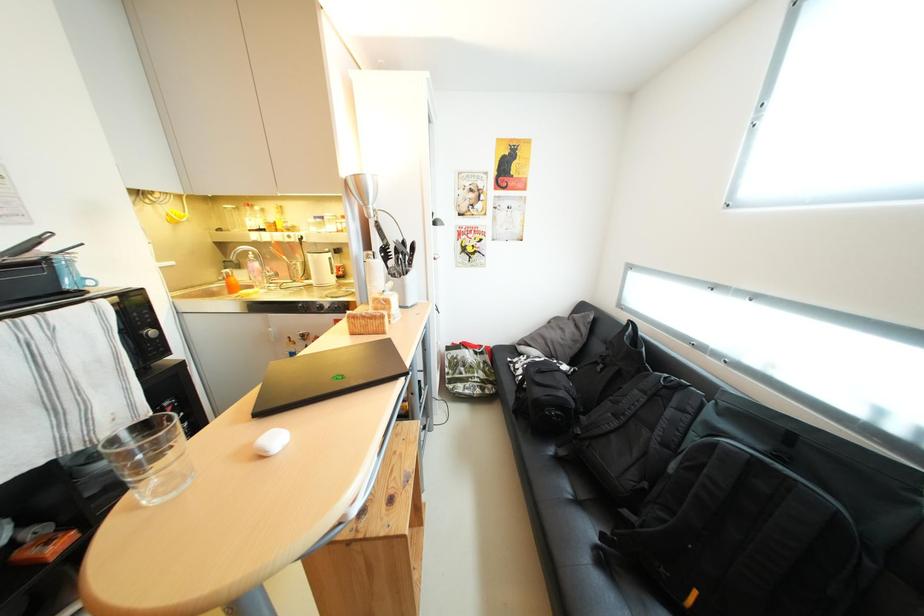
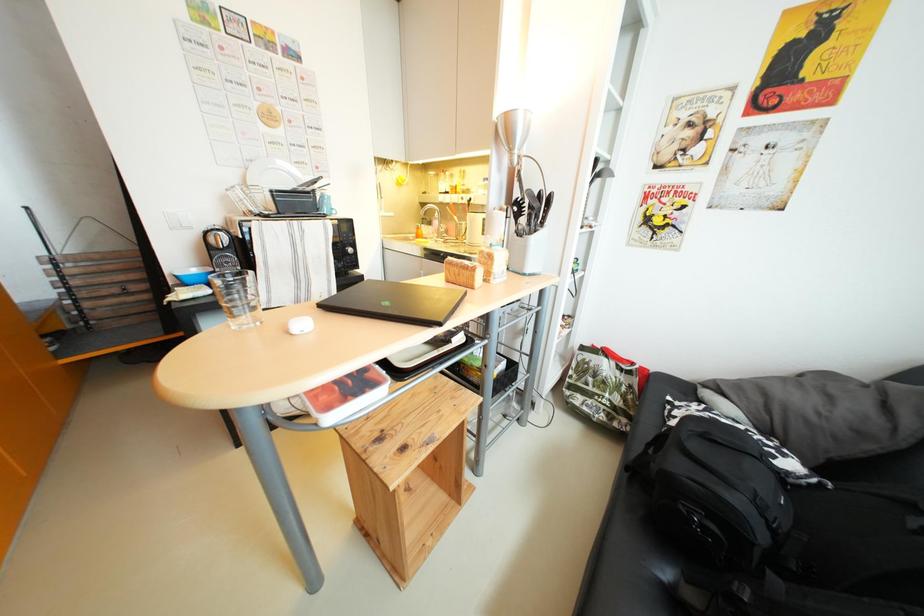
Question: Based on the continuous images, in which direction is the camera rotating? Reply with the corresponding letter.

Choices:
 (A) Left
 (B) Right
 (C) Up
 (D) Down

Answer: (A)